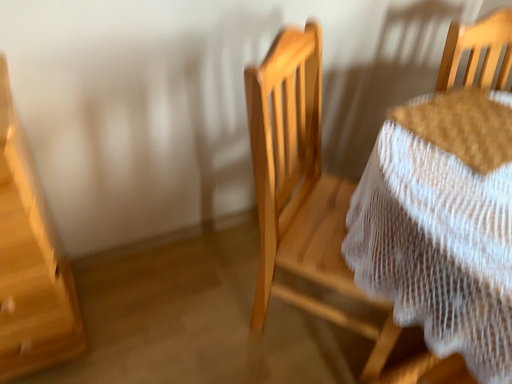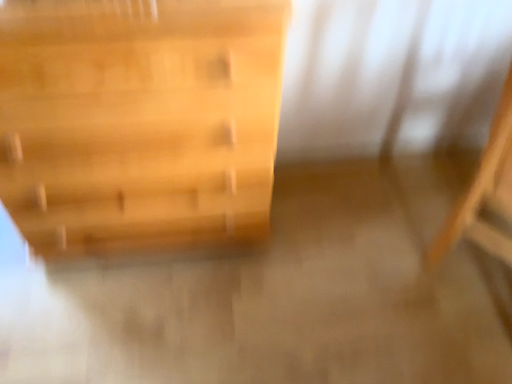
Question: How did the camera likely rotate when shooting the video?

Choices:
 (A) rotated right
 (B) rotated left

Answer: (B)